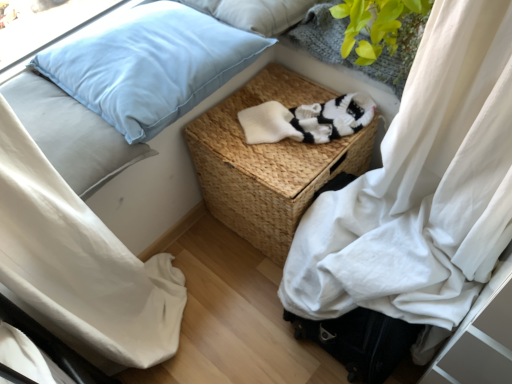
Question: In the image, is light blue fabric pillow at upper left, positioned as the second pillow in top-to-bottom order, positioned in front of or behind light blue fabric pillow at upper left, acting as the 1th pillow starting from the bottom?

Choices:
 (A) front
 (B) behind

Answer: (B)

Question: Is light blue fabric pillow at upper left, which is the second pillow from bottom to top, taller or shorter than light blue fabric pillow at upper left, which ranks as the third pillow in top-to-bottom order?

Choices:
 (A) tall
 (B) short

Answer: (B)

Question: Which is nearer to the light blue fabric pillow at upper left, acting as the 1th pillow starting from the bottom?

Choices:
 (A) light blue fabric pillow at upper left, the 1th pillow from the top
 (B) woven brown basket at center
 (C) light blue fabric pillow at upper left, which is the second pillow from bottom to top
 (D) green knitted plant at upper right
 (E) white knitted socks at center

Answer: (C)

Question: Which of these objects is positioned closest to the light blue fabric pillow at upper left, the 1th pillow from the top?

Choices:
 (A) woven brown basket at center
 (B) light blue fabric pillow at upper left, which is the second pillow from bottom to top
 (C) green knitted plant at upper right
 (D) white knitted socks at center
 (E) light blue fabric pillow at upper left, acting as the 1th pillow starting from the bottom

Answer: (C)